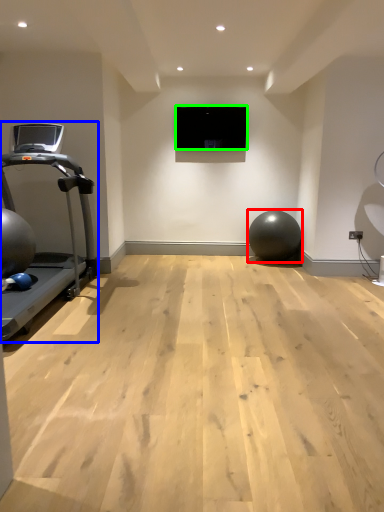
Question: Which object is the farthest from ball (highlighted by a red box)? Choose among these: treadmill (highlighted by a blue box) or projection screen (highlighted by a green box).

Choices:
 (A) treadmill
 (B) projection screen

Answer: (A)